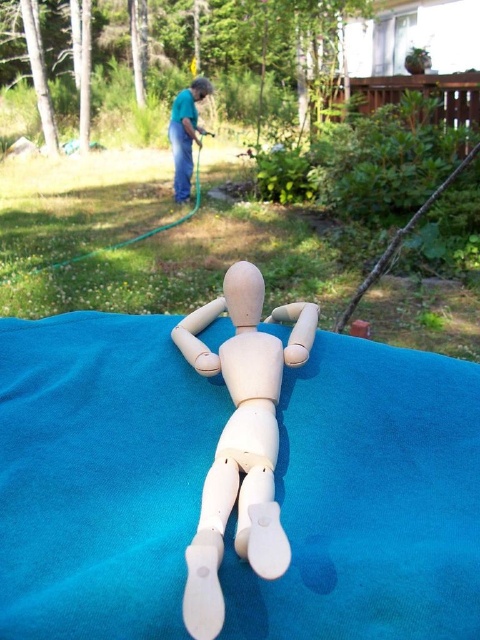
Question: Estimate the real-world distances between objects in this image. Which object is closer to the wooden mannequin at center?

Choices:
 (A) white matte tablecloth at center
 (B) blue fabric doll at upper center

Answer: (A)

Question: Which of the following is the closest to the observer?

Choices:
 (A) (385, 436)
 (B) (191, 120)

Answer: (A)

Question: Is wooden mannequin at center wider than blue fabric doll at upper center?

Choices:
 (A) no
 (B) yes

Answer: (A)

Question: From the image, what is the correct spatial relationship of white matte tablecloth at center in relation to wooden mannequin at center?

Choices:
 (A) left
 (B) right

Answer: (A)

Question: Which point is farther to the camera?

Choices:
 (A) wooden mannequin at center
 (B) white matte tablecloth at center

Answer: (B)

Question: Can you confirm if white matte tablecloth at center is positioned to the right of wooden mannequin at center?

Choices:
 (A) no
 (B) yes

Answer: (A)